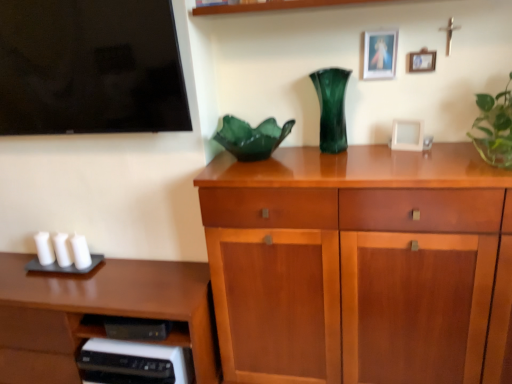
Find the location of a particular element. Image resolution: width=512 pixels, height=384 pixels. vacant region to the left of white matte picture frame at upper right, marked as the 1th picture frame in a bottom-to-top arrangement is located at coordinates (374, 145).